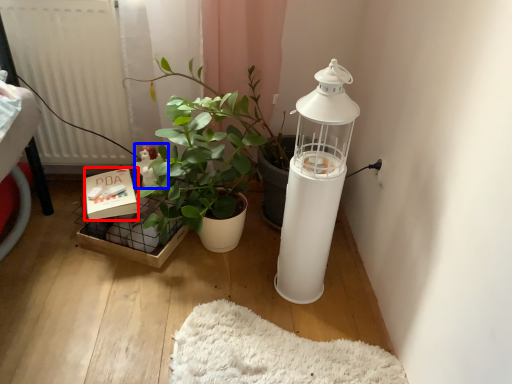
Question: Among these objects, which one is farthest to the camera, box (highlighted by a red box) or toy (highlighted by a blue box)?

Choices:
 (A) box
 (B) toy

Answer: (B)